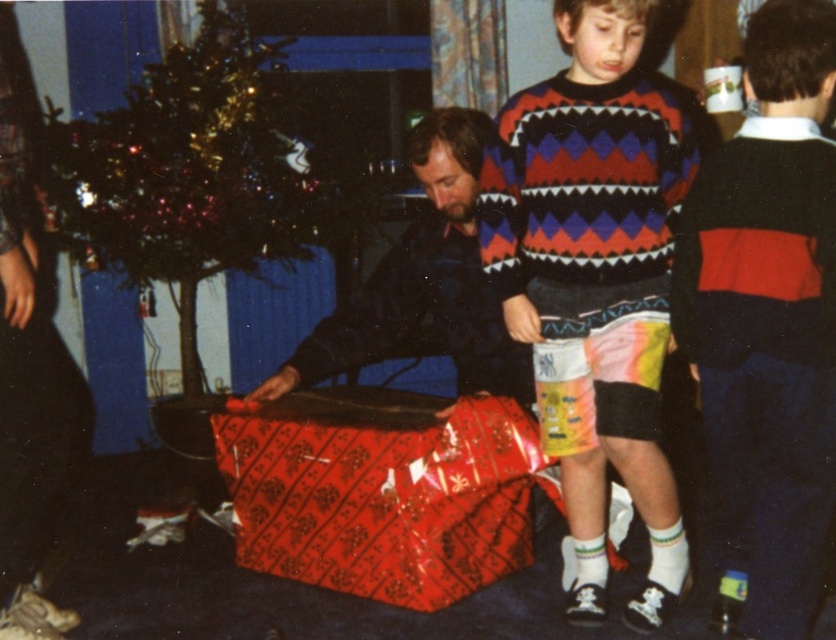
You are a delivery person who just arrived at the house. You need to place a new 1.5 meters long package between the knitted sweater at center and the shiny green christmas tree at left. Is there enough space to fit the package between them?

The knitted sweater at center is 1.41 meters away from the shiny green christmas tree at left. Since the package is 1.5 meters long, there isn not enough space to fit it between them.

You are a gift organizer in a store and you have two sweaters, a red sweater at center and a dark blue sweater at center, which one takes more space on the shelf?

The red sweater at center is larger in size than the dark blue sweater at center, so it takes more space on the shelf.

You are a guest at a Christmas party and see the red sweater at center and the shiny green christmas tree at left. Which object is closer to you?

The red sweater at center is closer to you because it is in front of the shiny green christmas tree at left.